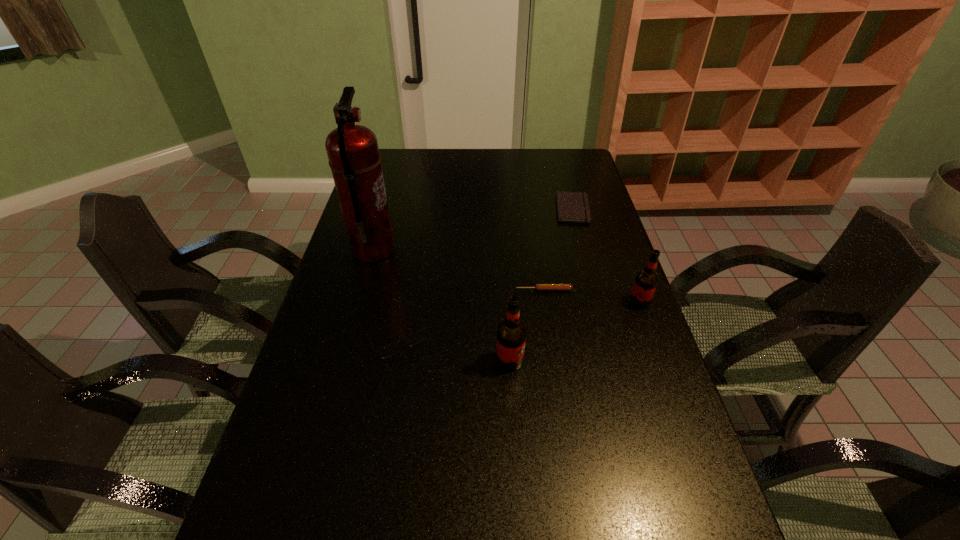
At what (x,y) coordinates should I click in order to perform the action: click on the second shortest object. Please return your answer as a coordinate pair (x, y). Looking at the image, I should click on (538, 287).

This screenshot has height=540, width=960. I want to click on free region located 0.230m on the back of the taller root beer, so click(505, 288).

Image resolution: width=960 pixels, height=540 pixels. What are the coordinates of `free location located on the left of the shorter root beer` in the screenshot? It's located at (598, 302).

The width and height of the screenshot is (960, 540). Find the location of `vacant area located on the front of the checkbook`. vacant area located on the front of the checkbook is located at coordinates (595, 295).

The image size is (960, 540). I want to click on vacant space located with the lenses facing outward on the spectacles, so click(388, 399).

Image resolution: width=960 pixels, height=540 pixels. What are the coordinates of `free space located on the nozzle side of the fifth nearest object` in the screenshot? It's located at (493, 250).

Find the location of a particular element. vacant space situated 0.400m on the left of the second shortest object is located at coordinates (380, 290).

Image resolution: width=960 pixels, height=540 pixels. I want to click on spectacles that is positioned at the left edge, so click(391, 349).

This screenshot has height=540, width=960. Identify the location of fire extinguisher at the left edge. (353, 152).

You are a GUI agent. You are given a task and a screenshot of the screen. Output one action in this format:
    pyautogui.click(x=<x>, y=<y>)
    Task: Click on the root beer at the right edge
    The height and width of the screenshot is (540, 960).
    Given the screenshot: What is the action you would take?
    pyautogui.click(x=646, y=280)